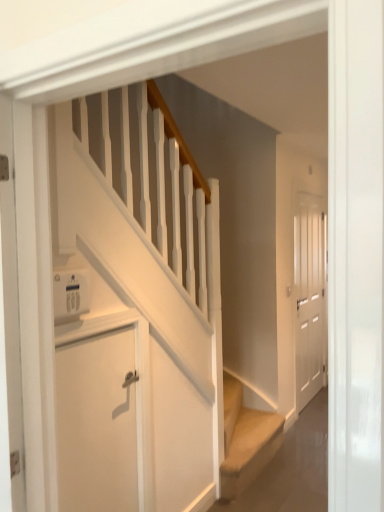
Question: Does white matte door at lower left, which appears as the 1th door when viewed from the front, lie in front of white plastic thermostat at upper left?

Choices:
 (A) yes
 (B) no

Answer: (B)

Question: Considering the relative sizes of white matte door at lower left, which appears as the first door when viewed from the left, and white plastic thermostat at upper left in the image provided, is white matte door at lower left, which appears as the first door when viewed from the left, bigger than white plastic thermostat at upper left?

Choices:
 (A) yes
 (B) no

Answer: (A)

Question: Is white matte door at lower left, which appears as the 1th door when viewed from the front, to the right of white plastic thermostat at upper left from the viewer's perspective?

Choices:
 (A) yes
 (B) no

Answer: (A)

Question: Could you tell me if white matte door at lower left, which appears as the first door when viewed from the left, is facing white plastic thermostat at upper left?

Choices:
 (A) yes
 (B) no

Answer: (B)

Question: From a real-world perspective, is white matte door at lower left, which appears as the first door when viewed from the left, below white plastic thermostat at upper left?

Choices:
 (A) no
 (B) yes

Answer: (B)

Question: Considering the relative sizes of white matte door at lower left, which appears as the first door when viewed from the left, and white plastic thermostat at upper left in the image provided, is white matte door at lower left, which appears as the first door when viewed from the left, taller than white plastic thermostat at upper left?

Choices:
 (A) yes
 (B) no

Answer: (A)

Question: Considering the relative sizes of white plastic thermostat at upper left and white matte door at lower left, which ranks as the second door in right-to-left order, in the image provided, is white plastic thermostat at upper left smaller than white matte door at lower left, which ranks as the second door in right-to-left order,?

Choices:
 (A) yes
 (B) no

Answer: (A)

Question: Is white plastic thermostat at upper left positioned in front of white matte door at lower left, which appears as the 1th door when viewed from the front?

Choices:
 (A) yes
 (B) no

Answer: (A)

Question: Is white plastic thermostat at upper left at the left side of white matte door at lower left, which ranks as the second door in right-to-left order?

Choices:
 (A) no
 (B) yes

Answer: (B)

Question: From a real-world perspective, is white plastic thermostat at upper left on white matte door at lower left, which appears as the 1th door when viewed from the front?

Choices:
 (A) yes
 (B) no

Answer: (A)

Question: Is white plastic thermostat at upper left oriented towards white matte door at lower left, which ranks as the second door in right-to-left order?

Choices:
 (A) no
 (B) yes

Answer: (A)

Question: Is white plastic thermostat at upper left placed right next to white matte door at lower left, which ranks as the second door in right-to-left order?

Choices:
 (A) yes
 (B) no

Answer: (B)

Question: From the image's perspective, is white matte door at right, the 1th door viewed from the back, under white matte door at lower left, which ranks as the second door in right-to-left order?

Choices:
 (A) no
 (B) yes

Answer: (A)